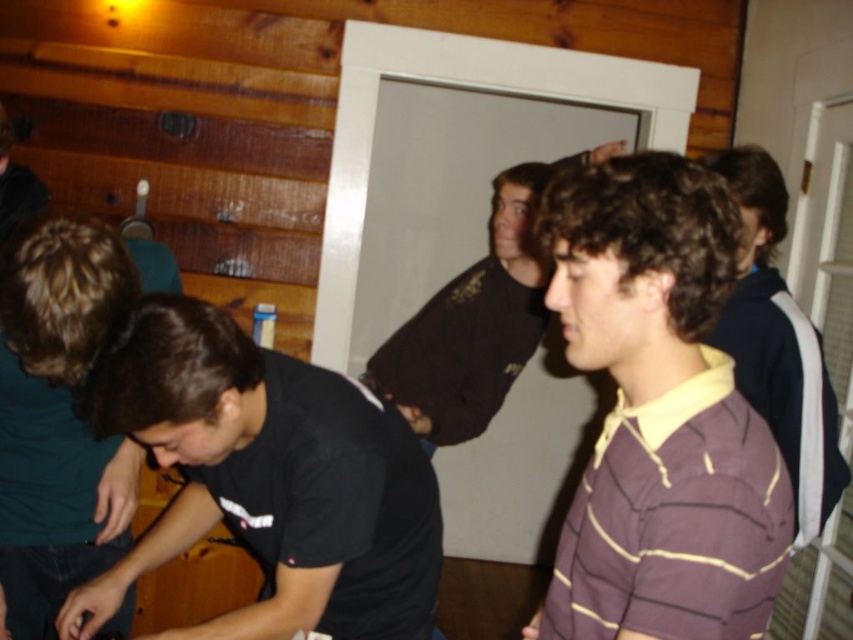
You are a photographer setting up a camera to take a group photo of the purple striped polo shirt at center and the black matte shirt at lower left. The camera has a minimum focus distance of 18 inches. Will you need to move the camera closer to ensure both subjects are in focus?

The purple striped polo shirt at center and the black matte shirt at lower left are 17.48 inches apart. Since the distance between them is less than the camera minimum focus distance of 18 inches, the camera does not need to be moved closer. Both subjects will be in focus.

You are organizing a photo shoot and need to place a small prop between the black matte shirt at lower left and the purple striped polo shirt at right. Based on their sizes, which side should the prop be closer to?

The black matte shirt at lower left is larger in size than the purple striped polo shirt at right, so the prop should be placed closer to the purple striped polo shirt at right to balance the visual weight.